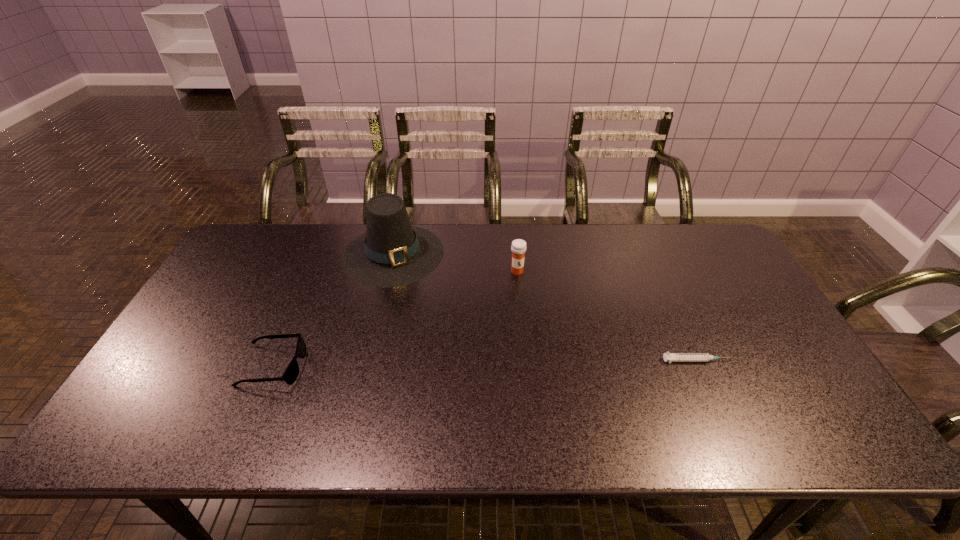
Where is `free space between the syringe and the sunglasses`? The image size is (960, 540). free space between the syringe and the sunglasses is located at coordinates (485, 363).

You are a GUI agent. You are given a task and a screenshot of the screen. Output one action in this format:
    pyautogui.click(x=<x>, y=<y>)
    Task: Click on the free space between the second shortest object and the medicine
    This screenshot has width=960, height=540.
    Given the screenshot: What is the action you would take?
    pyautogui.click(x=395, y=319)

Identify the location of free space between the tallest object and the medicine. (455, 262).

Where is `vacant point located between the rightmost object and the tallest object`? This screenshot has width=960, height=540. vacant point located between the rightmost object and the tallest object is located at coordinates (544, 307).

Select which object appears as the second closest to the third tallest object. Please provide its 2D coordinates. Your answer should be formatted as a tuple, i.e. [(x, y)], where the tuple contains the x and y coordinates of a point satisfying the conditions above.

[(518, 247)]

What are the coordinates of `object that can be found as the third closest to the tallest object` in the screenshot? It's located at (670, 357).

Find the location of `free space that satisfies the following two spatial constraints: 1. on the front side of the shortest object; 2. at the needle end of the medicine`. free space that satisfies the following two spatial constraints: 1. on the front side of the shortest object; 2. at the needle end of the medicine is located at coordinates (525, 360).